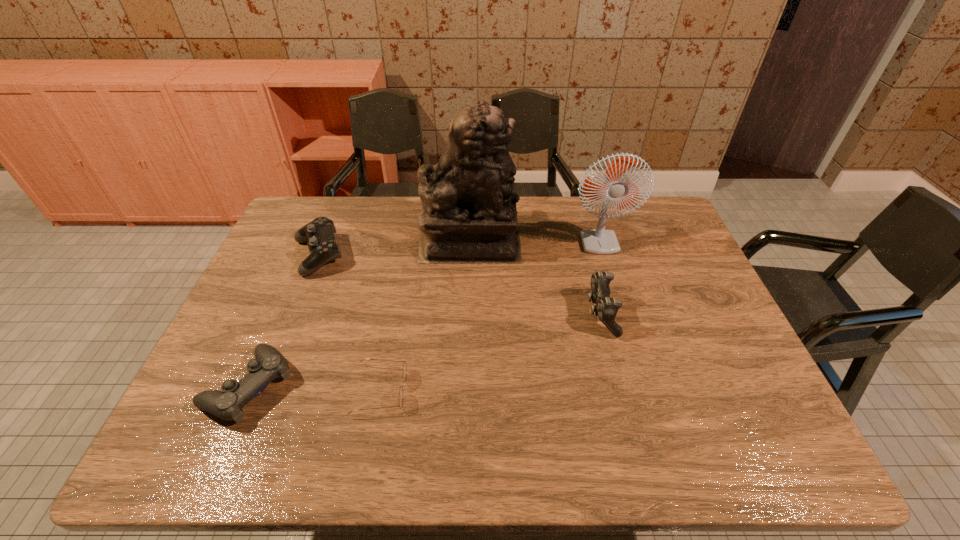
Identify the location of object present at the near edge. The image size is (960, 540). (269, 364).

At what (x,y) coordinates should I click in order to perform the action: click on object that is positioned at the right edge. Please return your answer as a coordinate pair (x, y). This screenshot has width=960, height=540. Looking at the image, I should click on (595, 241).

The image size is (960, 540). What are the coordinates of `object that is positioned at the far left corner` in the screenshot? It's located at (319, 234).

Locate an element on the screen. The height and width of the screenshot is (540, 960). object that is at the near left corner is located at coordinates (269, 364).

At what (x,y) coordinates should I click in order to perform the action: click on object situated at the far right corner. Please return your answer as a coordinate pair (x, y). This screenshot has height=540, width=960. Looking at the image, I should click on (595, 241).

You are a GUI agent. You are given a task and a screenshot of the screen. Output one action in this format:
    pyautogui.click(x=<x>, y=<y>)
    Task: Click on the vacant area at the far edge of the desktop
    
    Given the screenshot: What is the action you would take?
    pyautogui.click(x=583, y=220)

The width and height of the screenshot is (960, 540). I want to click on vacant space at the near edge, so click(647, 432).

In the image, there is a desktop. Where is `free region at the left edge`? free region at the left edge is located at coordinates (258, 298).

The image size is (960, 540). In the image, there is a desktop. What are the coordinates of `free region at the right edge` in the screenshot? It's located at (745, 403).

You are a GUI agent. You are given a task and a screenshot of the screen. Output one action in this format:
    pyautogui.click(x=<x>, y=<y>)
    Task: Click on the vacant space at the far left corner
    This screenshot has height=540, width=960.
    Given the screenshot: What is the action you would take?
    pyautogui.click(x=298, y=206)